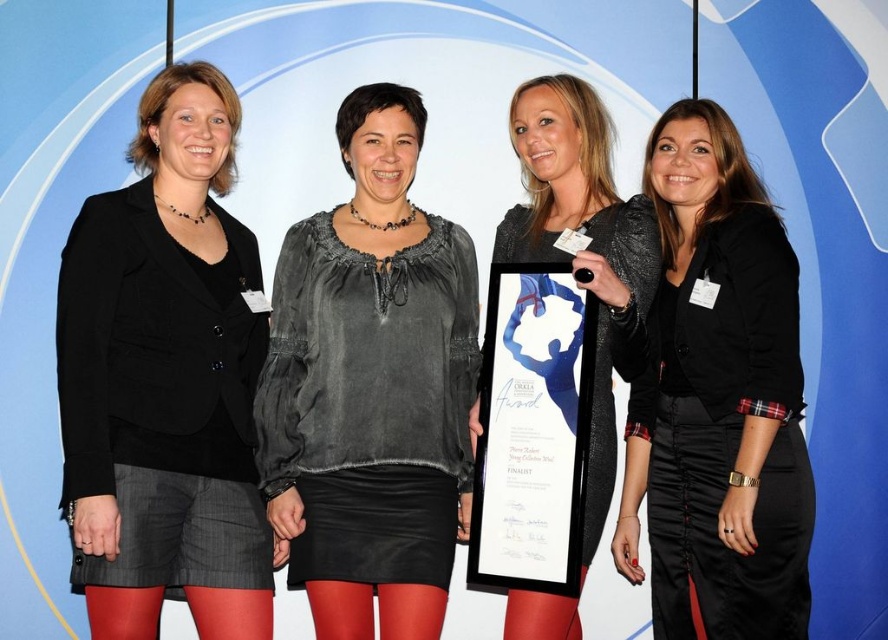
Question: Where is matte black blazer at left located in relation to black satin blazer at center in the image?

Choices:
 (A) right
 (B) left

Answer: (B)

Question: Which of the following is the closest to the observer?

Choices:
 (A) matte black dress at center
 (B) matte gray blouse at center
 (C) black satin blazer at center

Answer: (C)

Question: Based on their relative distances, which object is farther from the black satin blazer at center?

Choices:
 (A) matte gray blouse at center
 (B) matte black dress at center
 (C) matte black blazer at left

Answer: (C)

Question: Which point is closer to the camera?

Choices:
 (A) matte black blazer at left
 (B) black satin blazer at center
 (C) matte black dress at center

Answer: (A)

Question: In this image, where is matte black blazer at left located relative to matte gray blouse at center?

Choices:
 (A) right
 (B) left

Answer: (B)

Question: Is the position of black satin blazer at center more distant than that of matte black dress at center?

Choices:
 (A) no
 (B) yes

Answer: (A)